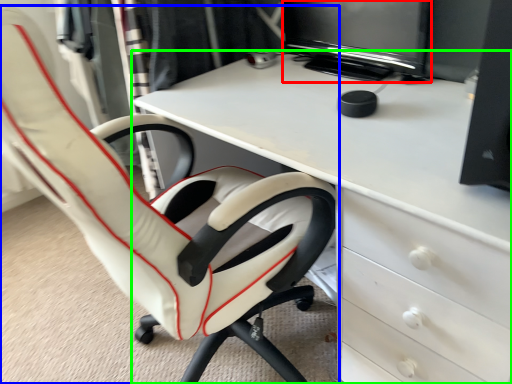
Question: Considering the real-world distances, which object is closest to computer monitor (highlighted by a red box)? chair (highlighted by a blue box) or desk (highlighted by a green box).

Choices:
 (A) chair
 (B) desk

Answer: (B)